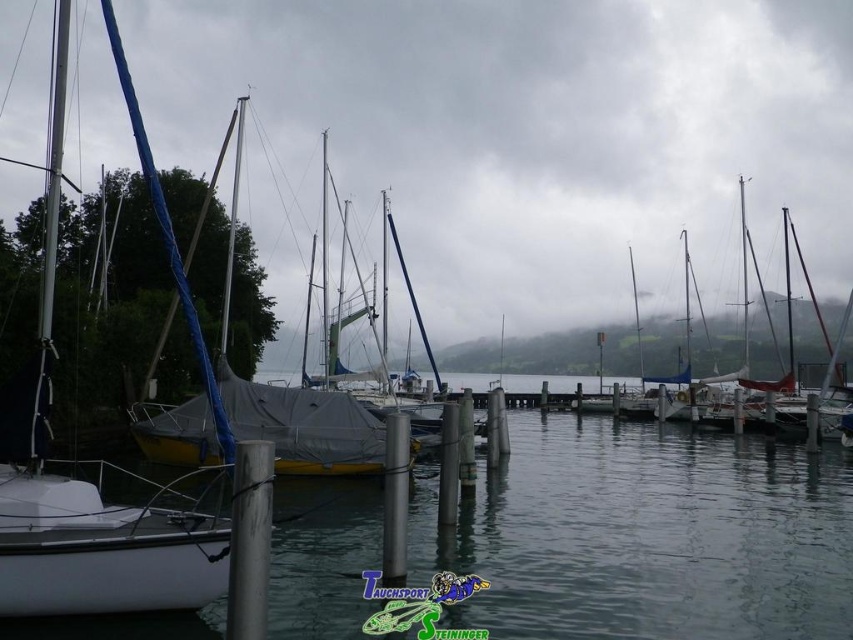
Question: Which object is farther from the camera taking this photo?

Choices:
 (A) clear water at center
 (B) white tarpaulin sailboat at center

Answer: (B)

Question: In this image, where is white matte sailboat at left located relative to white tarpaulin sailboat at center?

Choices:
 (A) right
 (B) left

Answer: (B)

Question: Which point is farther to the camera?

Choices:
 (A) clear water at center
 (B) white matte sailboat at left

Answer: (A)

Question: Which of the following is the farthest from the observer?

Choices:
 (A) (419, 561)
 (B) (30, 516)
 (C) (747, 237)

Answer: (C)

Question: Is white matte sailboat at left bigger than white tarpaulin sailboat at center?

Choices:
 (A) yes
 (B) no

Answer: (B)

Question: Can you confirm if clear water at center is bigger than white matte sailboat at left?

Choices:
 (A) no
 (B) yes

Answer: (B)